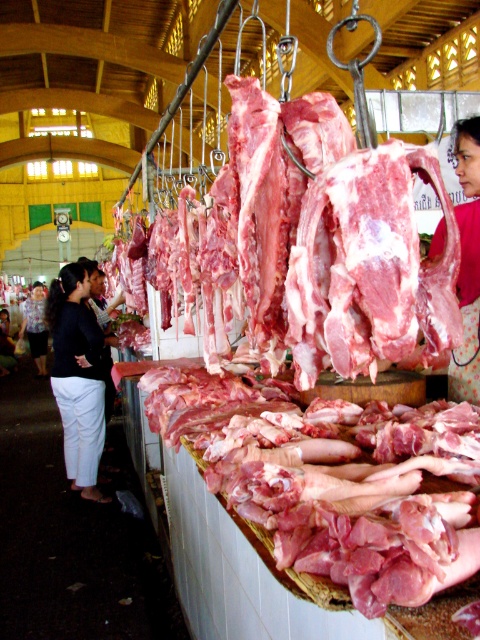
Question: Is black cotton pants at lower left closer to camera compared to matte pink fabric at center?

Choices:
 (A) no
 (B) yes

Answer: (A)

Question: Which object appears farthest from the camera in this image?

Choices:
 (A) black cotton pants at lower left
 (B) matte pink fabric at center

Answer: (A)

Question: Can you confirm if black cotton pants at lower left is thinner than matte pink fabric at center?

Choices:
 (A) no
 (B) yes

Answer: (A)

Question: Which point is closer to the camera?

Choices:
 (A) click(74, 266)
 (B) click(462, 225)

Answer: (B)

Question: Which of the following is the closest to the observer?

Choices:
 (A) matte pink fabric at center
 (B) black cotton pants at lower left

Answer: (A)

Question: Is black cotton pants at lower left closer to camera compared to matte pink fabric at center?

Choices:
 (A) yes
 (B) no

Answer: (B)